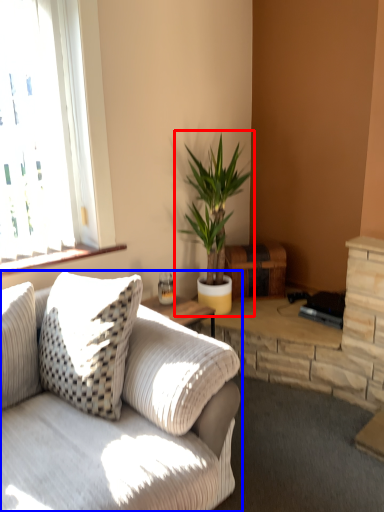
Question: Which of the following is the closest to the observer, houseplant (highlighted by a red box) or studio couch (highlighted by a blue box)?

Choices:
 (A) houseplant
 (B) studio couch

Answer: (B)